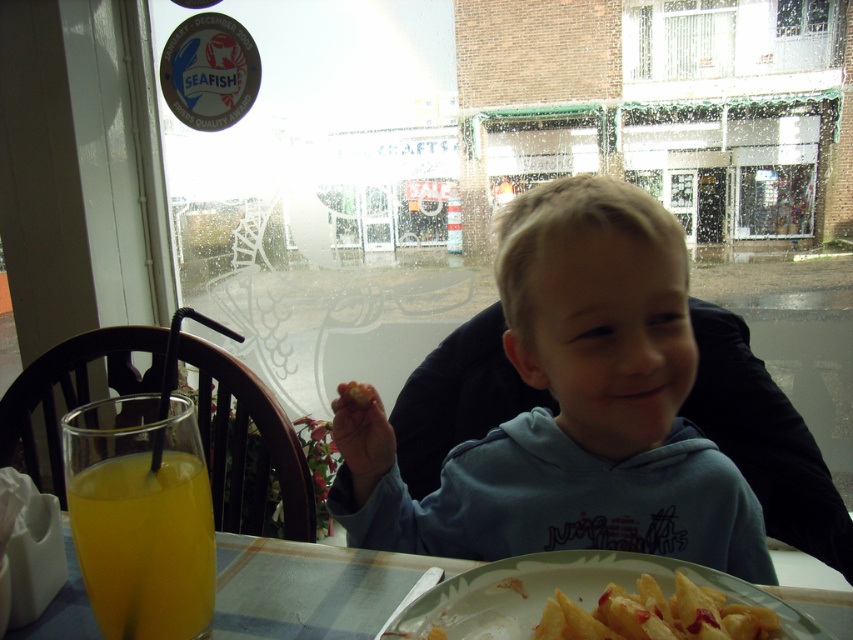
Question: Which is farther from the translucent orange juice at lower left?

Choices:
 (A) smooth orange carrot at center
 (B) light blue hoodie at center
 (C) white ceramic plate at lower center

Answer: (B)

Question: In this image, where is translucent orange juice at lower left located relative to golden crispy fries at lower center?

Choices:
 (A) below
 (B) above

Answer: (B)

Question: Can you confirm if light blue hoodie at center is wider than golden crispy fries at lower center?

Choices:
 (A) yes
 (B) no

Answer: (A)

Question: Which point appears closest to the camera in this image?

Choices:
 (A) (126, 525)
 (B) (671, 598)
 (C) (218, 592)
 (D) (598, 332)

Answer: (A)

Question: Which object is positioned farthest from the translucent orange juice at lower left?

Choices:
 (A) plastic table at lower center
 (B) smooth orange carrot at center
 (C) light blue hoodie at center

Answer: (C)

Question: Can you confirm if light blue hoodie at center is positioned to the left of golden crispy fries at lower center?

Choices:
 (A) yes
 (B) no

Answer: (B)